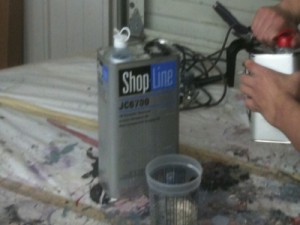
Where is `plastic cup`? plastic cup is located at coordinates (171, 211).